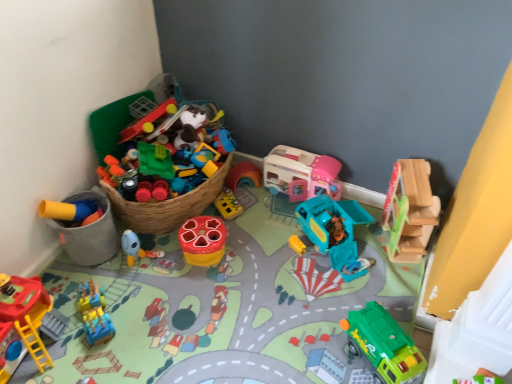
Where is `free space between teal plastic truck at center, which ranks as the third toy in right-to-left order, and blue plastic train at lower left, acting as the seventh toy starting from the right`? This screenshot has width=512, height=384. free space between teal plastic truck at center, which ranks as the third toy in right-to-left order, and blue plastic train at lower left, acting as the seventh toy starting from the right is located at coordinates (211, 279).